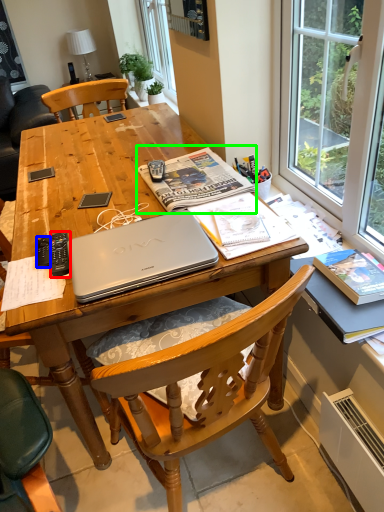
Question: Which object is the farthest from remote control (highlighted by a red box)? Choose among these: remote control (highlighted by a blue box) or magazine (highlighted by a green box).

Choices:
 (A) remote control
 (B) magazine

Answer: (B)